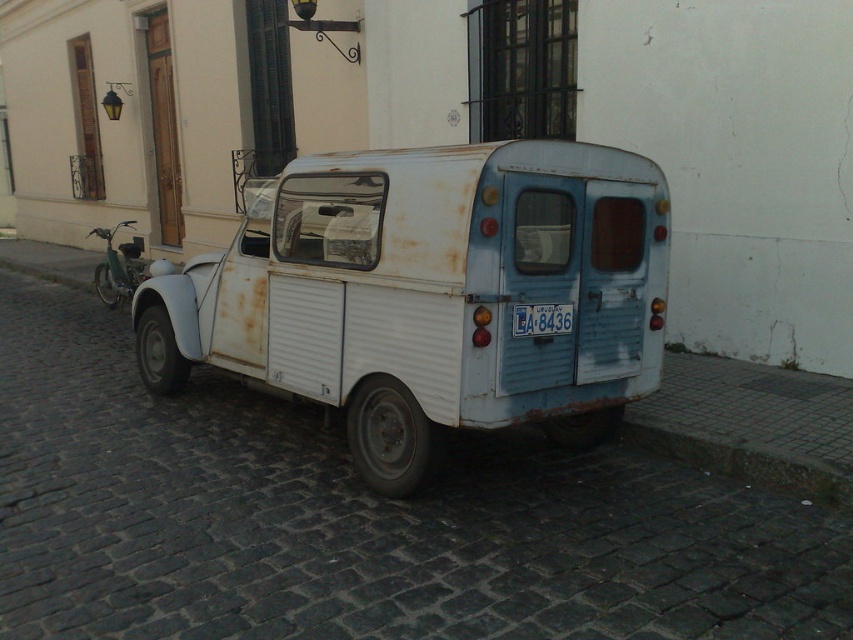
Question: Does rusty metal van at center appear under white plastic license plate at center?

Choices:
 (A) yes
 (B) no

Answer: (A)

Question: Does rusty metal van at center appear over white plastic license plate at center?

Choices:
 (A) yes
 (B) no

Answer: (B)

Question: Where is rusty metal van at center located in relation to white plastic license plate at center in the image?

Choices:
 (A) below
 (B) above

Answer: (A)

Question: Which point is farther to the camera?

Choices:
 (A) white plastic license plate at center
 (B) rusty metal van at center

Answer: (A)

Question: Which point appears farthest from the camera in this image?

Choices:
 (A) (514, 314)
 (B) (329, 390)

Answer: (B)